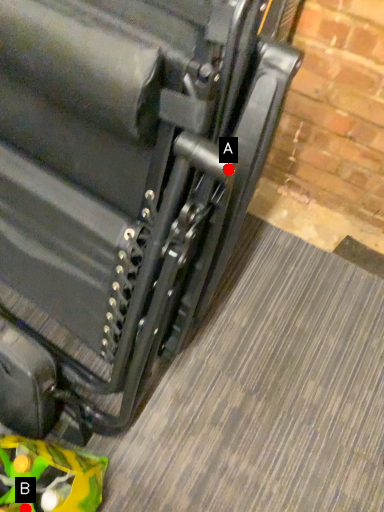
Question: Two points are circled on the image, labeled by A and B beside each circle. Which point is further to the camera?

Choices:
 (A) A is further
 (B) B is further

Answer: (B)